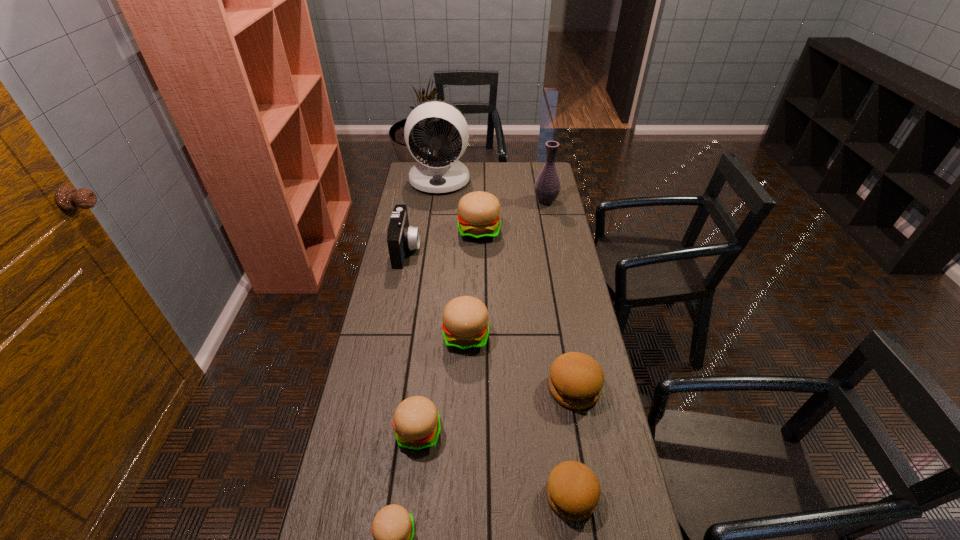
The height and width of the screenshot is (540, 960). Find the location of `brown hamburger that can be found as the closest to the black camcorder`. brown hamburger that can be found as the closest to the black camcorder is located at coordinates (576, 380).

This screenshot has height=540, width=960. Identify the location of brown hamburger that is the nearest to the farthest beige hamburger. (576, 380).

Locate an element on the screen. free spot that satisfies the following two spatial constraints: 1. on the front side of the farthest beige hamburger; 2. on the left side of the smaller brown hamburger is located at coordinates (478, 496).

Image resolution: width=960 pixels, height=540 pixels. In order to click on free space that satisfies the following two spatial constraints: 1. on the lens of the fourth nearest hamburger; 2. on the right side of the camcorder in this screenshot , I will do `click(380, 388)`.